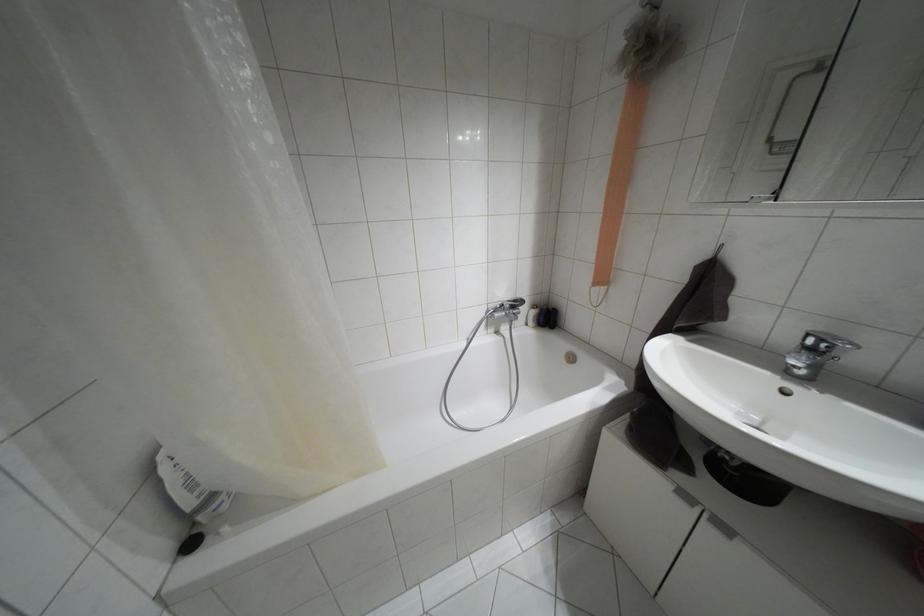
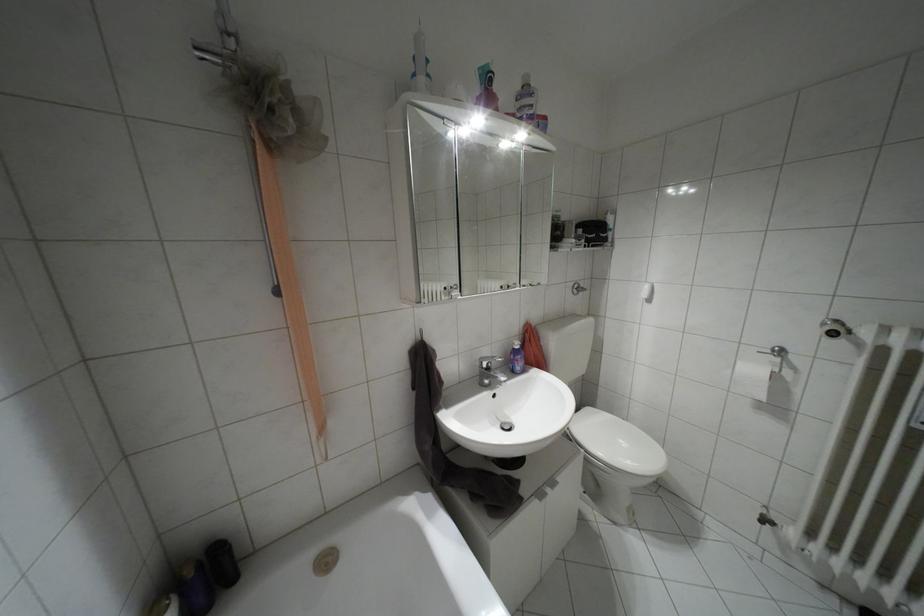
Question: How did the camera likely rotate?

Choices:
 (A) Left
 (B) Right
 (C) Up
 (D) Down

Answer: (B)